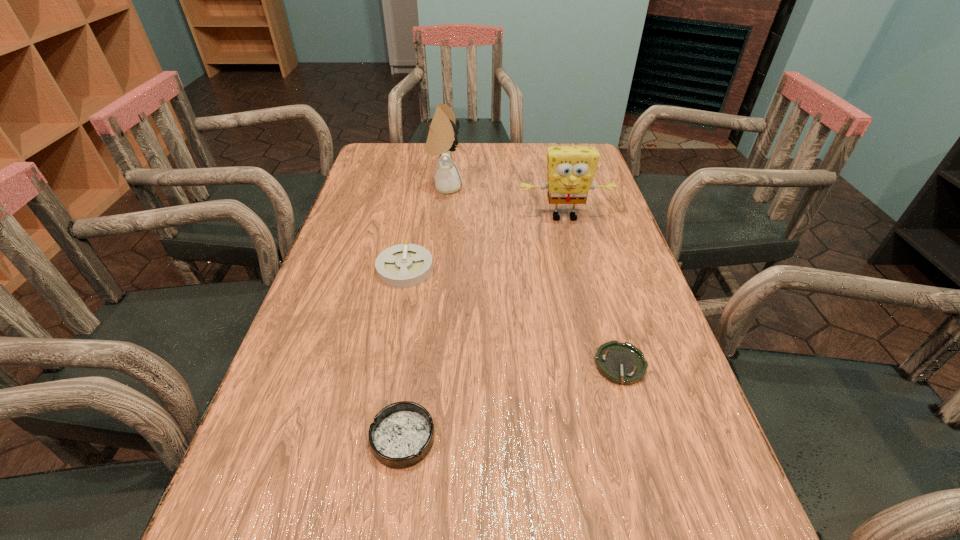
Find the location of a particular element. The image size is (960, 540). free space that is in between the fourth shortest object and the shortest ashtray is located at coordinates (592, 292).

Image resolution: width=960 pixels, height=540 pixels. In order to click on free point between the farthest ashtray and the second nearest object in this screenshot , I will do `click(513, 317)`.

Find the location of `object that is the second closest to the tallest ashtray`. object that is the second closest to the tallest ashtray is located at coordinates (571, 169).

Locate an element on the screen. object that is the closest to the tallest object is located at coordinates (571, 169).

You are a GUI agent. You are given a task and a screenshot of the screen. Output one action in this format:
    pyautogui.click(x=<x>, y=<y>)
    Task: Click on the ashtray that stands as the second closest to the third nearest object
    This screenshot has height=540, width=960.
    Given the screenshot: What is the action you would take?
    pyautogui.click(x=621, y=363)

Locate which ashtray ranks second in proximity to the tallest object. Please provide its 2D coordinates. Your answer should be formatted as a tuple, i.e. [(x, y)], where the tuple contains the x and y coordinates of a point satisfying the conditions above.

[(621, 363)]

You are a GUI agent. You are given a task and a screenshot of the screen. Output one action in this format:
    pyautogui.click(x=<x>, y=<y>)
    Task: Click on the vacant position in the image that satisfies the following two spatial constraints: 1. at the front face of the doll; 2. on the back side of the shortest ashtray
    The width and height of the screenshot is (960, 540).
    Given the screenshot: What is the action you would take?
    pyautogui.click(x=425, y=366)

I want to click on vacant space that satisfies the following two spatial constraints: 1. at the front face of the fourth farthest object; 2. on the right side of the farthest object, so click(x=425, y=366).

Find the location of a particular element. free space that satisfies the following two spatial constraints: 1. on the front side of the third farthest object; 2. on the left side of the shortest ashtray is located at coordinates (386, 366).